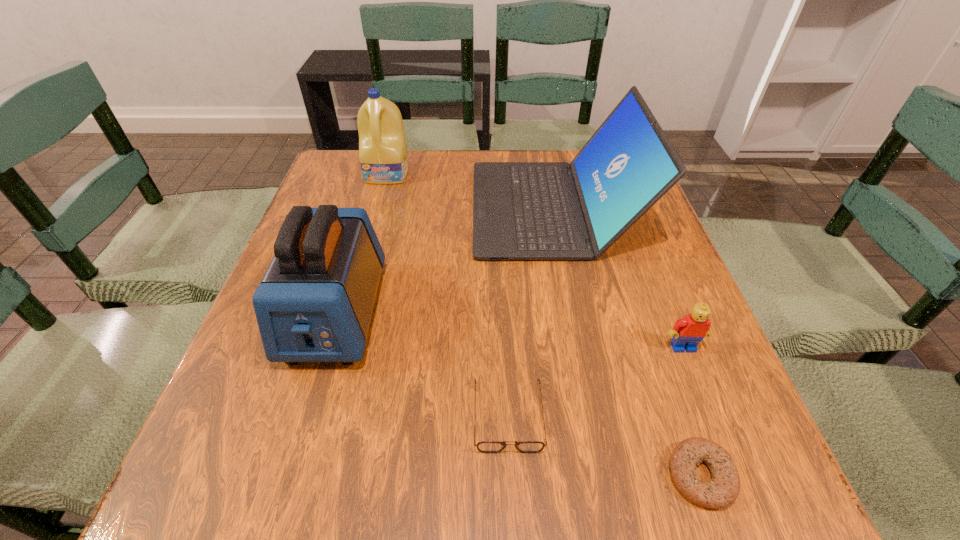
You are a GUI agent. You are given a task and a screenshot of the screen. Output one action in this format:
    pyautogui.click(x=<x>, y=<y>)
    Task: Click on the laptop computer located at the right edge
    
    Given the screenshot: What is the action you would take?
    pyautogui.click(x=521, y=210)

This screenshot has width=960, height=540. I want to click on Lego positioned at the right edge, so [688, 331].

You are a GUI agent. You are given a task and a screenshot of the screen. Output one action in this format:
    pyautogui.click(x=<x>, y=<y>)
    Task: Click on the bagel at the right edge
    This screenshot has height=540, width=960.
    Given the screenshot: What is the action you would take?
    pyautogui.click(x=721, y=491)

Where is `object present at the far left corner`? object present at the far left corner is located at coordinates (383, 157).

The width and height of the screenshot is (960, 540). I want to click on object at the far right corner, so click(521, 210).

Identify the location of object present at the near right corner. This screenshot has width=960, height=540. (721, 491).

Where is `free location at the far edge`? free location at the far edge is located at coordinates point(526,157).

At what (x,y) coordinates should I click in order to perform the action: click on vacant region at the left edge of the desktop. Please return your answer as a coordinate pair (x, y). Looking at the image, I should click on (266, 402).

Find the location of a particular element. vacant space at the right edge is located at coordinates (649, 293).

The image size is (960, 540). I want to click on vacant space at the far left corner of the desktop, so click(356, 164).